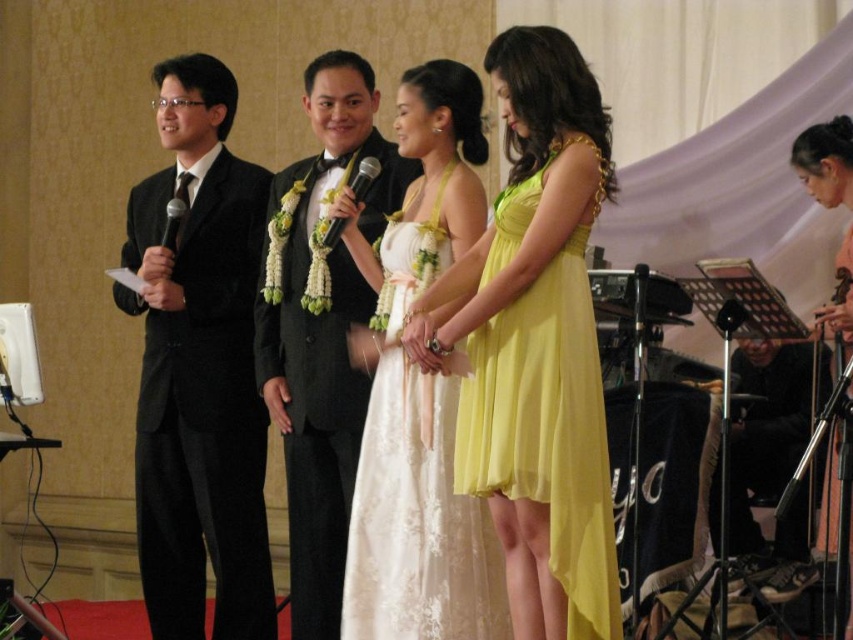
Does black velvet suit at left have a larger size compared to black metallic microphone at center?

Indeed, black velvet suit at left has a larger size compared to black metallic microphone at center.

Is black velvet suit at left above black metallic microphone at center?

Actually, black velvet suit at left is below black metallic microphone at center.

Does point (161, 266) lie in front of point (355, 192)?

No.

At what (x,y) coordinates should I click in order to perform the action: click on black velvet suit at left. Please return your answer as a coordinate pair (x, y). Looking at the image, I should click on (199, 368).

Locate an element on the screen. This screenshot has height=640, width=853. black velvet suit at left is located at coordinates (199, 368).

Does black velvet suit at left come in front of white lace dress at center?

No, it is behind white lace dress at center.

This screenshot has width=853, height=640. I want to click on black velvet suit at left, so [199, 368].

How much distance is there between yellow chiffon dress at center and black metallic microphone at left?

A distance of 5.71 feet exists between yellow chiffon dress at center and black metallic microphone at left.

Between yellow chiffon dress at center and black metallic microphone at left, which one is positioned higher?

black metallic microphone at left

Locate an element on the screen. yellow chiffon dress at center is located at coordinates (544, 387).

Identify the location of yellow chiffon dress at center. (544, 387).